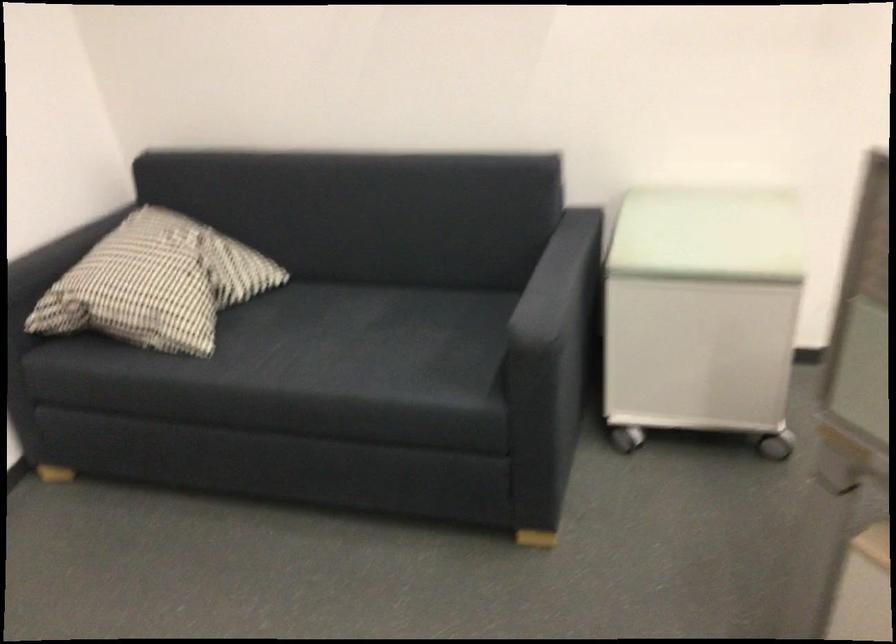
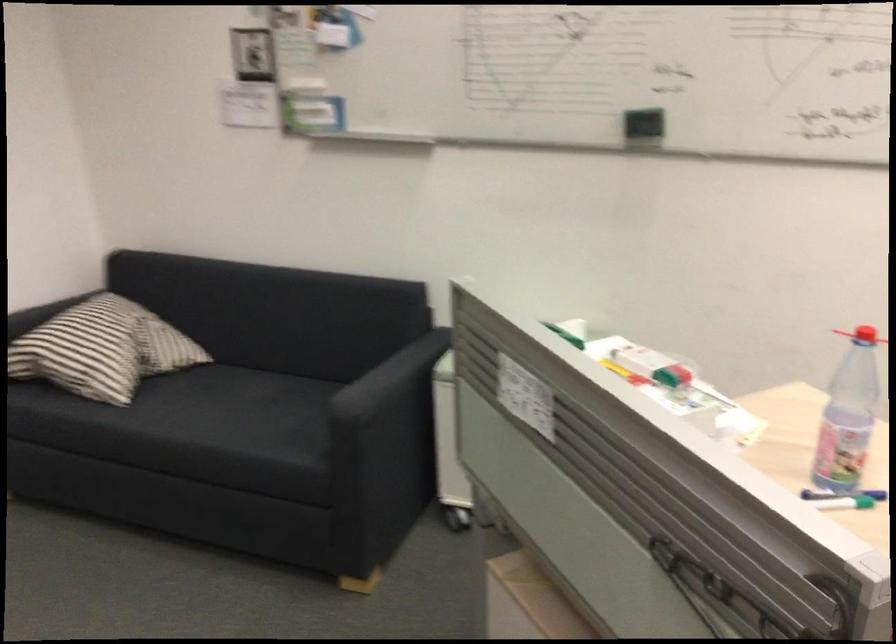
Which direction would the cameraman need to move to produce the second image?

The cameraman walked toward right, backward.